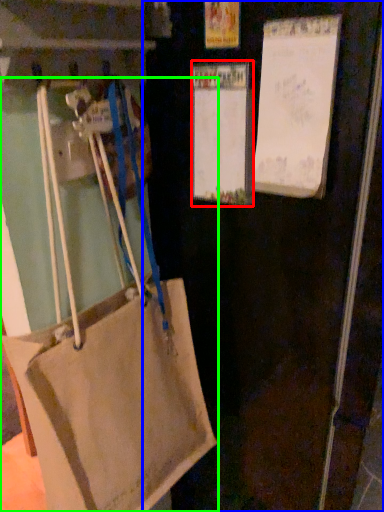
Question: Which object is positioned closest to bulletin board (highlighted by a red box)? Select from door (highlighted by a blue box) and handbag (highlighted by a green box).

Choices:
 (A) door
 (B) handbag

Answer: (A)